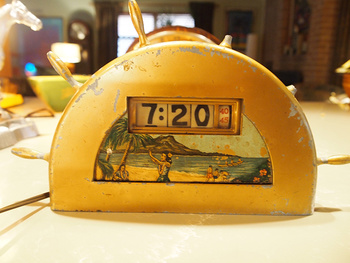
Locate an element on the screen. This screenshot has height=263, width=350. window is located at coordinates (121, 25).